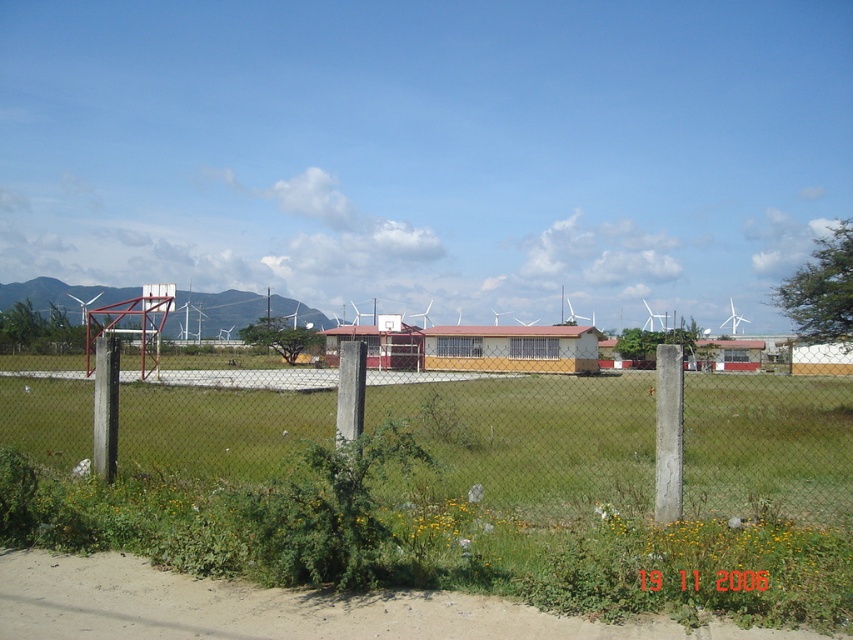
You are standing at the origin point of the image. A metal mesh fence at center is located at point (531, 435). Which direction should you move to reach the metal mesh fence at center?

The metal mesh fence at center is located at point (531, 435), so you should move towards the center of the image to reach it.

You are a basketball player standing at the edge of the basketball court. You want to shoot the ball into the metallic red basketball hoop at center. However, there is a metal mesh fence at center in your way. Can you shoot the ball over the fence to reach the hoop?

The metal mesh fence at center is located below the metallic red basketball hoop at center, so you can shoot the ball over the fence to reach the hoop.

You are standing at the edge of the metal mesh fence at center and want to throw a ball to the metallic red basketball hoop at center. Considering their positions, will the fence block your throw?

The metal mesh fence at center is in front of the metallic red basketball hoop at center, so the fence will block your throw.